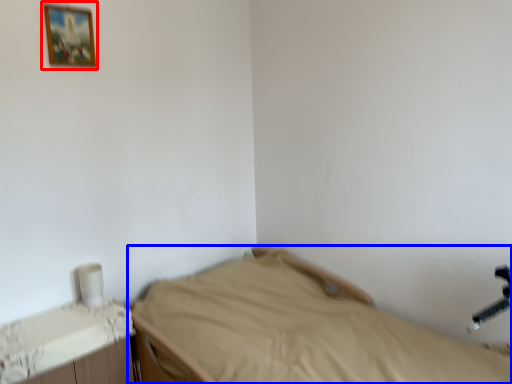
Question: Which of the following is the closest to the observer, picture frame (highlighted by a red box) or bed (highlighted by a blue box)?

Choices:
 (A) picture frame
 (B) bed

Answer: (B)